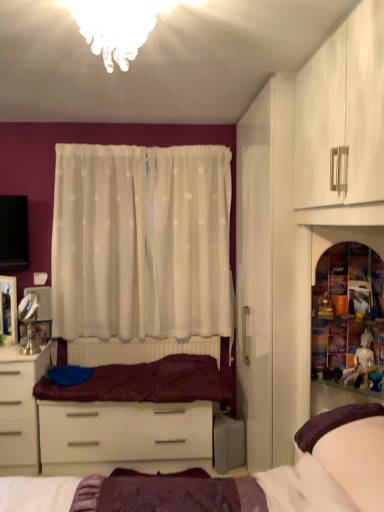
Measure the distance between white glossy drawer at center and camera.

white glossy drawer at center and camera are 2.64 meters apart.

This screenshot has width=384, height=512. What are the coordinates of `white glossy drawer at center` in the screenshot? It's located at (124, 436).

What is the approximate width of white sheer curtain at center?

white sheer curtain at center is 7.37 inches wide.

This screenshot has height=512, width=384. What do you see at coordinates (141, 241) in the screenshot?
I see `white sheer curtain at center` at bounding box center [141, 241].

The image size is (384, 512). What do you see at coordinates (115, 28) in the screenshot? I see `translucent glass chandelier at upper center` at bounding box center [115, 28].

Locate an element on the screen. The width and height of the screenshot is (384, 512). white glossy desk at lower left is located at coordinates (19, 409).

Image resolution: width=384 pixels, height=512 pixels. I want to click on silver/metallic makeup mirror at left, so click(29, 321).

From a real-world perspective, is maroon velvet blanket at center located beneath white glossy desk at lower left?

Actually, maroon velvet blanket at center is physically above white glossy desk at lower left in the real world.

Is maroon velvet blanket at center to the left or to the right of white glossy desk at lower left in the image?

Based on their positions, maroon velvet blanket at center is located to the right of white glossy desk at lower left.

Looking at their sizes, would you say maroon velvet blanket at center is wider or thinner than white glossy desk at lower left?

In the image, maroon velvet blanket at center appears to be more narrow than white glossy desk at lower left.

Is white glossy desk at lower left bigger or smaller than translucent glass chandelier at upper center?

Clearly, white glossy desk at lower left is larger in size than translucent glass chandelier at upper center.

Consider the image. Could translucent glass chandelier at upper center be considered to be inside white glossy desk at lower left?

That's incorrect, translucent glass chandelier at upper center is not inside white glossy desk at lower left.

Considering the relative sizes of white glossy desk at lower left and translucent glass chandelier at upper center in the image provided, is white glossy desk at lower left thinner than translucent glass chandelier at upper center?

No.

Does point (13, 391) come farther from viewer compared to point (85, 1)?

Yes, point (13, 391) is behind point (85, 1).

Is maroon velvet blanket at center thinner than translucent glass chandelier at upper center?

Incorrect, the width of maroon velvet blanket at center is not less than that of translucent glass chandelier at upper center.

From their relative heights in the image, would you say maroon velvet blanket at center is taller or shorter than translucent glass chandelier at upper center?

Clearly, maroon velvet blanket at center is shorter compared to translucent glass chandelier at upper center.

From the image's perspective, which one is positioned lower, maroon velvet blanket at center or translucent glass chandelier at upper center?

From the image's view, maroon velvet blanket at center is below.

I want to click on light fixture that appears on the right of maroon velvet blanket at center, so click(x=115, y=28).

Would you say translucent glass shelf at right is part of white glossy desk at lower left's contents?

No, translucent glass shelf at right is not surrounded by white glossy desk at lower left.

Is white glossy desk at lower left beside translucent glass shelf at right?

white glossy desk at lower left and translucent glass shelf at right are not in contact.

Considering the relative positions of white glossy desk at lower left and translucent glass shelf at right in the image provided, is white glossy desk at lower left to the right of translucent glass shelf at right from the viewer's perspective?

Incorrect, white glossy desk at lower left is not on the right side of translucent glass shelf at right.

Which object is more forward, white glossy desk at lower left or translucent glass shelf at right?

translucent glass shelf at right.

From the picture: Based on their positions, is white glossy drawer at center located to the left or right of translucent glass chandelier at upper center?

From the image, it's evident that white glossy drawer at center is to the left of translucent glass chandelier at upper center.

Does white glossy drawer at center touch translucent glass chandelier at upper center?

No, white glossy drawer at center is not in contact with translucent glass chandelier at upper center.

Is white glossy drawer at center taller or shorter than translucent glass chandelier at upper center?

Clearly, white glossy drawer at center is taller compared to translucent glass chandelier at upper center.

This screenshot has width=384, height=512. I want to click on light fixture lying on the right of silver/metallic makeup mirror at left, so click(115, 28).

Is silver/metallic makeup mirror at left bigger than translucent glass chandelier at upper center?

No.

Is silver/metallic makeup mirror at left looking in the opposite direction of translucent glass chandelier at upper center?

That's not correct — silver/metallic makeup mirror at left is not looking away from translucent glass chandelier at upper center.

Is translucent glass chandelier at upper center completely or partially inside silver/metallic makeup mirror at left?

No, silver/metallic makeup mirror at left does not contain translucent glass chandelier at upper center.

Is maroon velvet blanket at center looking in the opposite direction of translucent glass shelf at right?

No.

Can you confirm if maroon velvet blanket at center is wider than translucent glass shelf at right?

Correct, the width of maroon velvet blanket at center exceeds that of translucent glass shelf at right.

Is maroon velvet blanket at center next to translucent glass shelf at right and touching it?

No, maroon velvet blanket at center is not with translucent glass shelf at right.

Would you say maroon velvet blanket at center contains translucent glass shelf at right?

No, translucent glass shelf at right is not a part of maroon velvet blanket at center.

In order to click on bedding above the white glossy desk at lower left (from the image's perspective) in this screenshot , I will do `click(146, 383)`.

Image resolution: width=384 pixels, height=512 pixels. Identify the location of desk behind the translucent glass chandelier at upper center. (19, 409).

Considering their positions, is translucent glass chandelier at upper center positioned closer to white sheer curtain at center than silver/metallic makeup mirror at left?

Among the two, silver/metallic makeup mirror at left is located nearer to white sheer curtain at center.

Which object lies nearer to the anchor point maroon velvet blanket at center, white glossy drawer at center or white glossy desk at lower left?

Based on the image, white glossy drawer at center appears to be nearer to maroon velvet blanket at center.

When comparing their distances from white glossy desk at lower left, does white glossy drawer at center or white sheer curtain at center seem further?

white sheer curtain at center lies further to white glossy desk at lower left than the other object.

Based on their spatial positions, is white glossy desk at lower left or silver/metallic makeup mirror at left closer to white glossy drawer at center?

The object closer to white glossy drawer at center is white glossy desk at lower left.

Considering their positions, is silver/metallic makeup mirror at left positioned further to maroon velvet blanket at center than white glossy drawer at center?

silver/metallic makeup mirror at left lies further to maroon velvet blanket at center than the other object.

Based on their spatial positions, is translucent glass chandelier at upper center or white glossy desk at lower left closer to white glossy drawer at center?

Among the two, white glossy desk at lower left is located nearer to white glossy drawer at center.

Which object lies nearer to the anchor point white glossy drawer at center, silver/metallic makeup mirror at left or white sheer curtain at center?

silver/metallic makeup mirror at left is positioned closer to the anchor white glossy drawer at center.

Looking at this image, when comparing their distances from translucent glass chandelier at upper center, does maroon velvet blanket at center or white glossy desk at lower left seem further?

white glossy desk at lower left.

Locate an element on the screen. mirror situated between white glossy desk at lower left and white glossy drawer at center from left to right is located at coordinates (29, 321).

Find the location of a particular element. The width and height of the screenshot is (384, 512). entertainment center between silver/metallic makeup mirror at left and maroon velvet blanket at center is located at coordinates (124, 436).

Locate an element on the screen. The height and width of the screenshot is (512, 384). mirror that lies between white sheer curtain at center and white glossy desk at lower left from top to bottom is located at coordinates (29, 321).

Locate an element on the screen. desk between white sheer curtain at center and white glossy drawer at center from top to bottom is located at coordinates (19, 409).